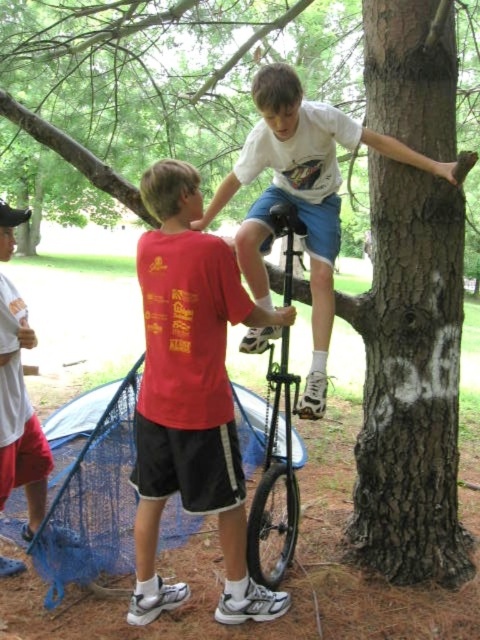
Does matte red t-shirt at center appear on the left side of white matte/uniform shirt at upper center?

Yes, matte red t-shirt at center is to the left of white matte/uniform shirt at upper center.

Does point (224, 609) come farther from viewer compared to point (308, 100)?

No, (224, 609) is closer to viewer.

You are a GUI agent. You are given a task and a screenshot of the screen. Output one action in this format:
    pyautogui.click(x=<x>, y=<y>)
    Task: Click on the matte red t-shirt at center
    
    Given the screenshot: What is the action you would take?
    pyautogui.click(x=191, y=396)

Between white cotton shirt at center and black matte unicycle at center, which one has more height?

black matte unicycle at center

Is white cotton shirt at center further to the viewer compared to black matte unicycle at center?

Yes, white cotton shirt at center is further from the viewer.

You are a GUI agent. You are given a task and a screenshot of the screen. Output one action in this format:
    pyautogui.click(x=<x>, y=<y>)
    Task: Click on the white cotton shirt at center
    The image size is (480, 640).
    Given the screenshot: What is the action you would take?
    pyautogui.click(x=20, y=413)

The image size is (480, 640). In order to click on white cotton shirt at center in this screenshot , I will do `click(20, 413)`.

Is matte red t-shirt at center in front of black matte unicycle at center?

Yes, matte red t-shirt at center is closer to the viewer.

Locate an element on the screen. The image size is (480, 640). matte red t-shirt at center is located at coordinates (191, 396).